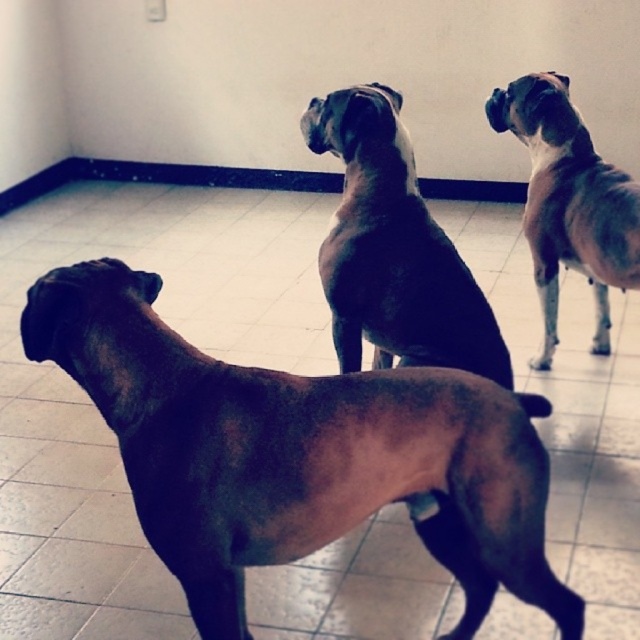
Is point (560, 620) positioned before point (358, 150)?

Yes, it is.

Is brown matte dog at center wider than brown fur dog at center?

Correct, the width of brown matte dog at center exceeds that of brown fur dog at center.

Where is `brown matte dog at center`? The image size is (640, 640). brown matte dog at center is located at coordinates 298,452.

Which is more to the right, brown fur dog at center or brown smooth coat at upper right?

brown smooth coat at upper right

Is brown fur dog at center above brown smooth coat at upper right?

Incorrect, brown fur dog at center is not positioned above brown smooth coat at upper right.

The image size is (640, 640). Find the location of `brown fur dog at center`. brown fur dog at center is located at coordinates (394, 250).

Which is below, brown matte dog at center or brown smooth coat at upper right?

brown matte dog at center is below.

Who is positioned more to the right, brown matte dog at center or brown smooth coat at upper right?

brown smooth coat at upper right is more to the right.

Which is in front, point (225, 497) or point (600, 273)?

Point (225, 497) is in front.

Find the location of a particular element. brown matte dog at center is located at coordinates (298, 452).